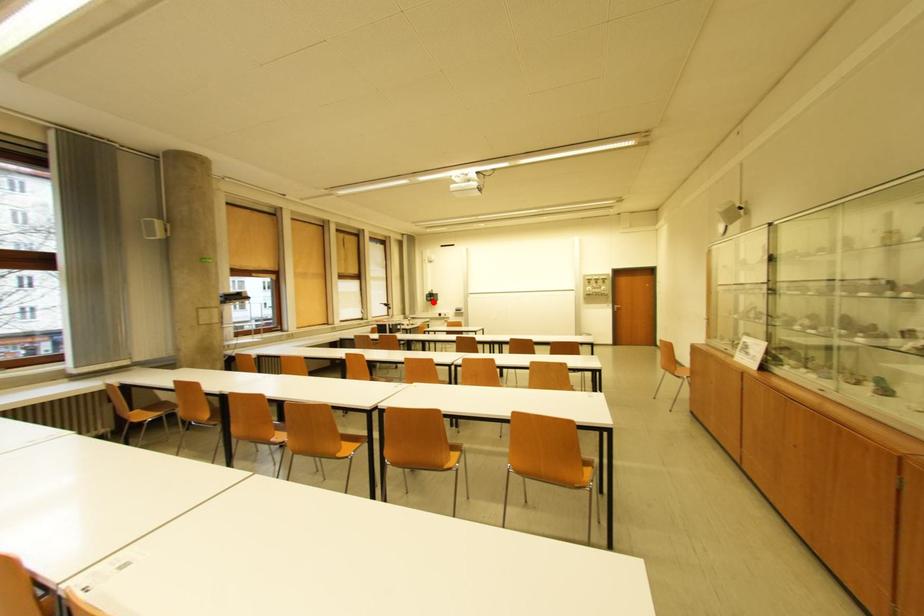
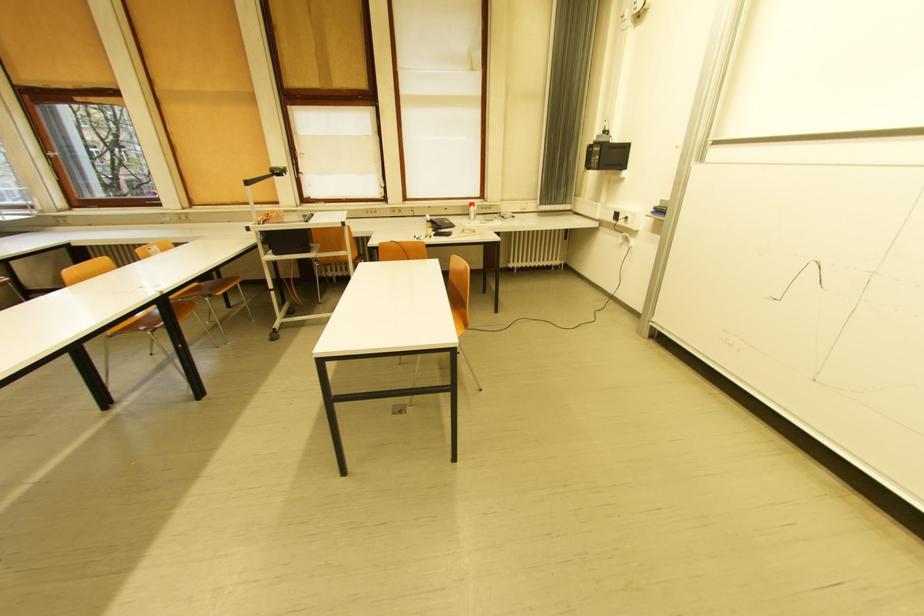
Question: I am providing you with two images of the same scene from different viewpoints. Image1 has a red point marked. In image2, the corresponding 3D location appears at what relative position? Reply with the corresponding letter.

Choices:
 (A) Closer
 (B) Farther

Answer: (A)